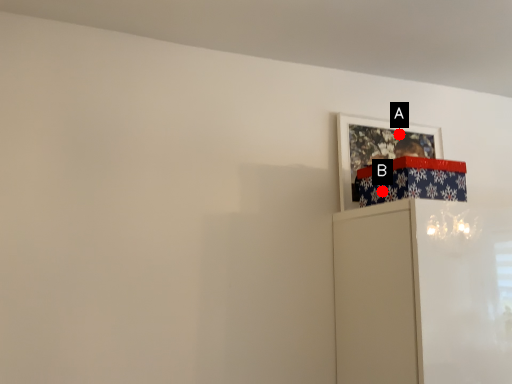
Question: Two points are circled on the image, labeled by A and B beside each circle. Which of the following is the farthest from the observer?

Choices:
 (A) A is further
 (B) B is further

Answer: (A)